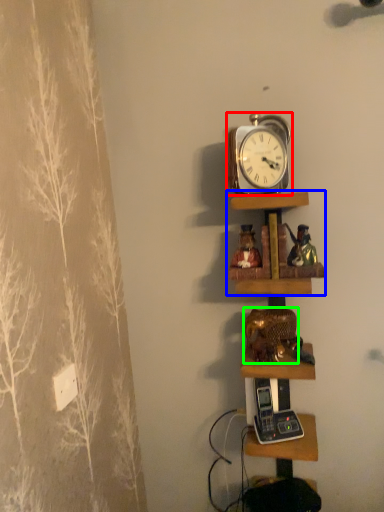
Question: Which object is the farthest from alarm clock (highlighted by a red box)? Choose among these: shelf (highlighted by a blue box) or toy (highlighted by a green box).

Choices:
 (A) shelf
 (B) toy

Answer: (B)